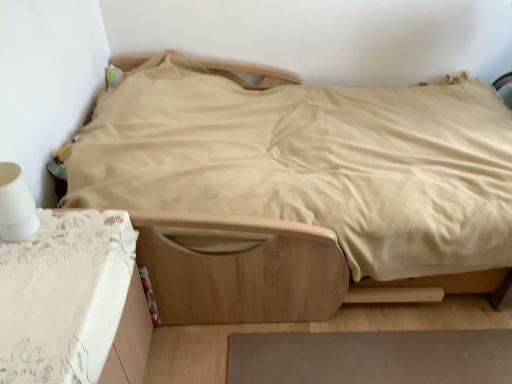
This screenshot has height=384, width=512. What are the coordinates of `free location to the right of white matte table lamp at left` in the screenshot? It's located at (75, 237).